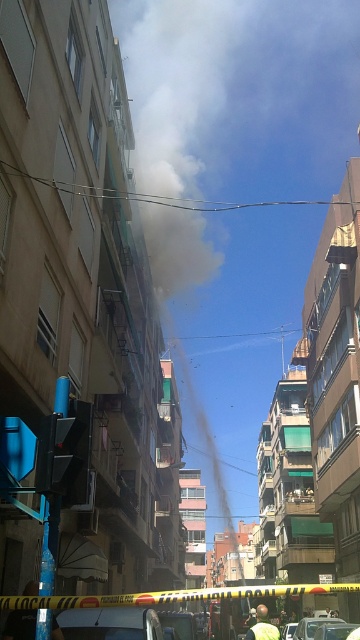
Does white smoke at center have a lesser width compared to yellow fabric shirt at center?

Incorrect, white smoke at center's width is not less than yellow fabric shirt at center's.

In the scene shown: Who is positioned more to the right, white smoke at center or yellow fabric shirt at center?

Positioned to the right is white smoke at center.

You are a GUI agent. You are given a task and a screenshot of the screen. Output one action in this format:
    pyautogui.click(x=<x>, y=<y>)
    Task: Click on the white smoke at center
    This screenshot has width=360, height=640.
    Given the screenshot: What is the action you would take?
    pyautogui.click(x=172, y=88)